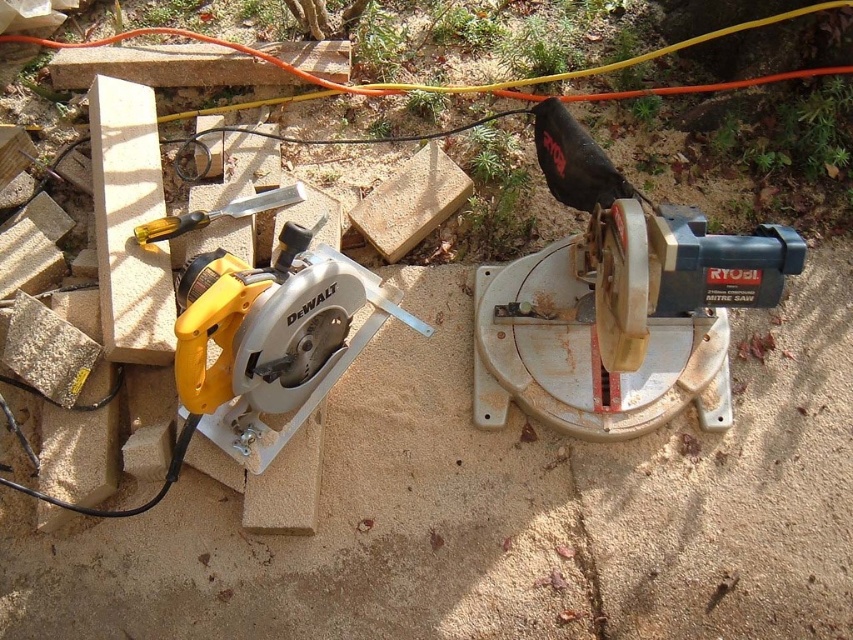
Question: Is the position of yellow plastic circular saw at left less distant than that of yellow plastic-handled chisel at center-left?

Choices:
 (A) no
 (B) yes

Answer: (B)

Question: Which of these objects is positioned farthest from the yellow plastic circular saw at left?

Choices:
 (A) rusty metal mitre saw at center
 (B) yellow plastic-handled chisel at center-left

Answer: (A)

Question: Can you confirm if rusty metal mitre saw at center is positioned to the right of yellow plastic-handled chisel at center-left?

Choices:
 (A) yes
 (B) no

Answer: (A)

Question: Among these objects, which one is farthest from the camera?

Choices:
 (A) yellow plastic-handled chisel at center-left
 (B) yellow plastic circular saw at left

Answer: (A)

Question: Is rusty metal mitre saw at center further to the viewer compared to yellow plastic circular saw at left?

Choices:
 (A) yes
 (B) no

Answer: (B)

Question: Which object is farther from the camera taking this photo?

Choices:
 (A) yellow plastic-handled chisel at center-left
 (B) yellow plastic circular saw at left

Answer: (A)